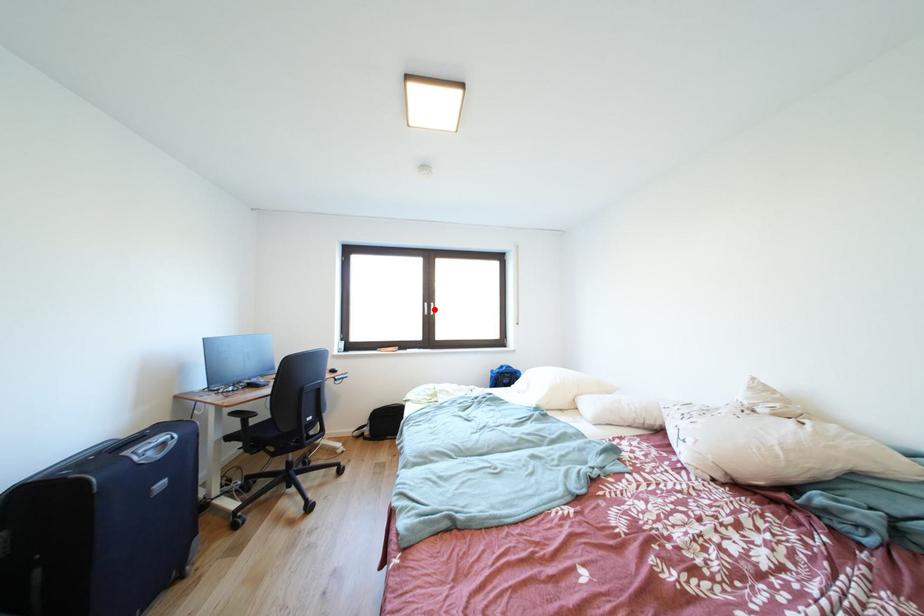
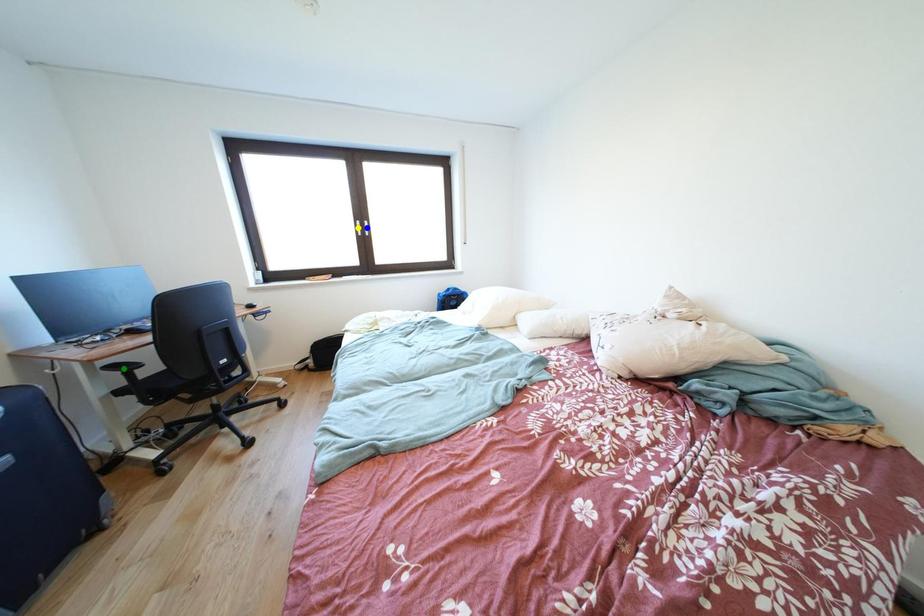
Question: I am providing you with two images of the same scene from different viewpoints. A red point is marked on the first image. You are given multiple points on the second image. Which point in image 2 is actually the same real-world point as the red point in image 1?

Choices:
 (A) green point
 (B) yellow point
 (C) blue point

Answer: (C)